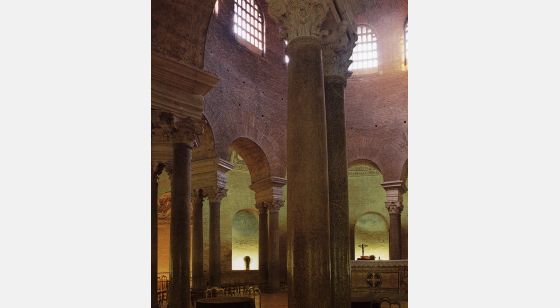
The image size is (560, 308). I want to click on chairs, so click(163, 290).